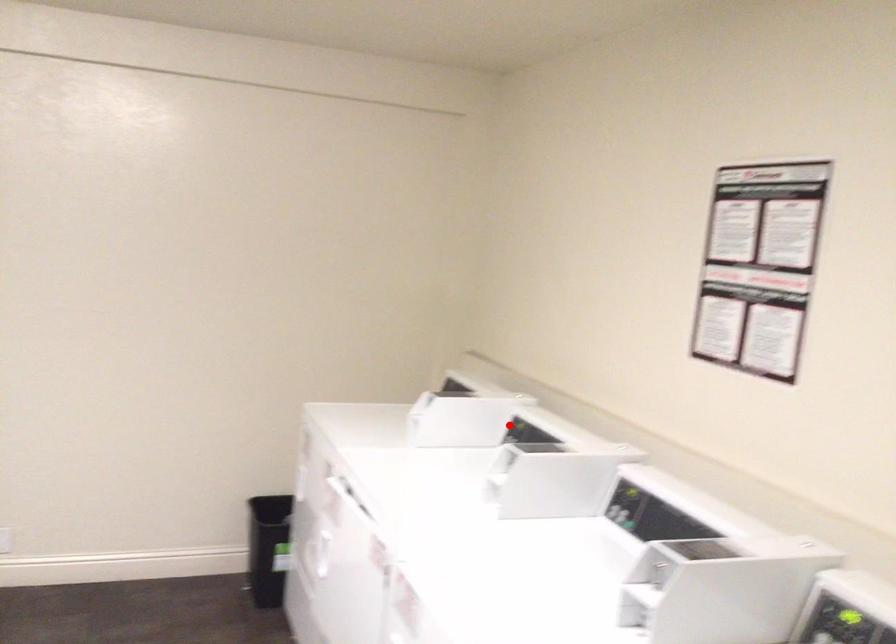
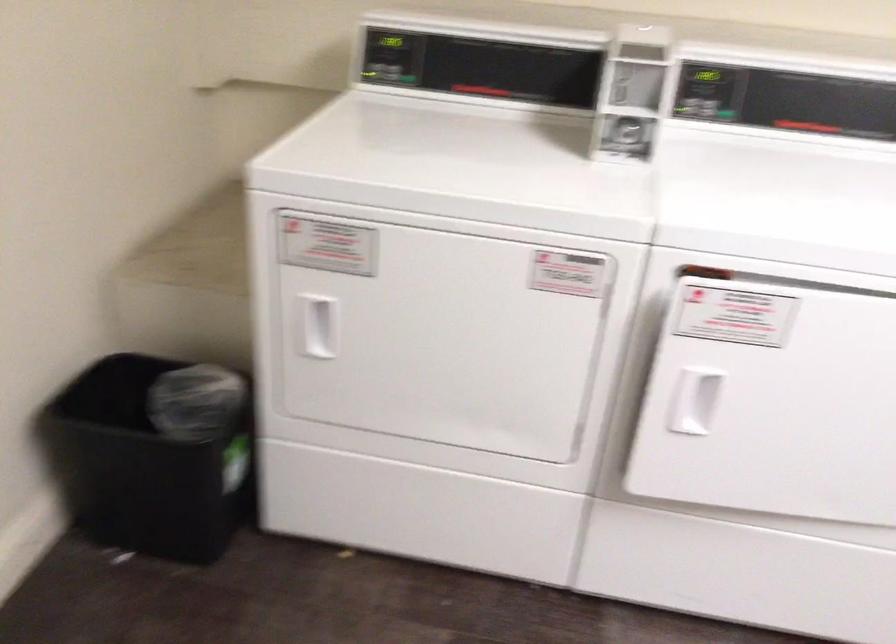
Question: I am providing you with two images of the same scene from different viewpoints. A red point is marked on the first image. Can you still see the location of the red point in image 2?

Choices:
 (A) Yes
 (B) No

Answer: (B)